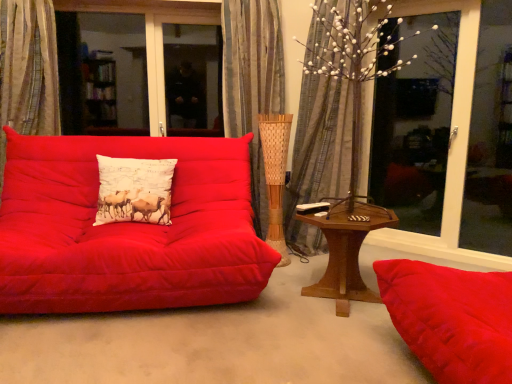
Locate an element on the screen. free spot below wooden hexagonal table at center (from a real-world perspective) is located at coordinates (332, 297).